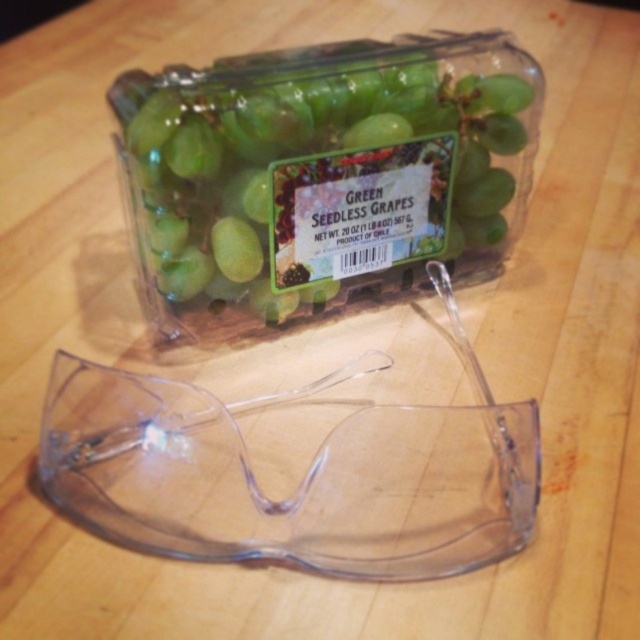
You are a quality inspector in a food packaging facility. You need to check the label on the green matte seedless grapes at upper center. Your transparent plastic goggles at center are blocking your view. Can you reach the grapes without moving the goggles?

The green matte seedless grapes at upper center and transparent plastic goggles at center are 27.91 centimeters apart from each other. Since the goggles are blocking your view but are 27.91 cm away, you can likely reach the grapes without moving the goggles by extending your arm or leaning forward, as the distance is manageable for inspection purposes.

You are at a grocery store and want to pick up the transparent plastic goggles at center to examine them. Can you reach them without moving the green matte seedless grapes at upper center?

The transparent plastic goggles at center is behind the green matte seedless grapes at upper center, so you can reach them without moving the grapes because they are positioned behind them.

You are a quality inspector checking the grapes in the image. The grapes are at point (324, 170). Where exactly are the grapes located in the image?

The green matte seedless grapes at upper center are located at point (324, 170).